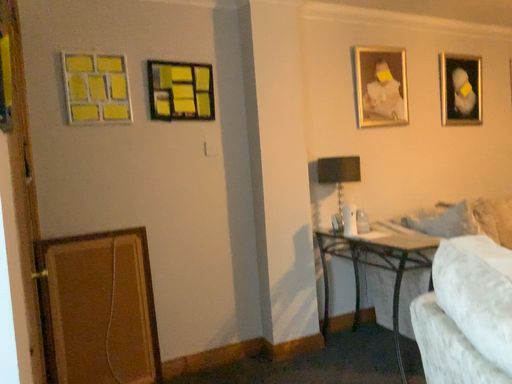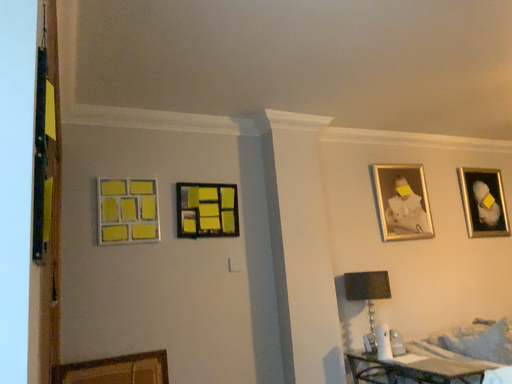
Question: Which way did the camera rotate in the video?

Choices:
 (A) rotated upward
 (B) rotated downward

Answer: (A)